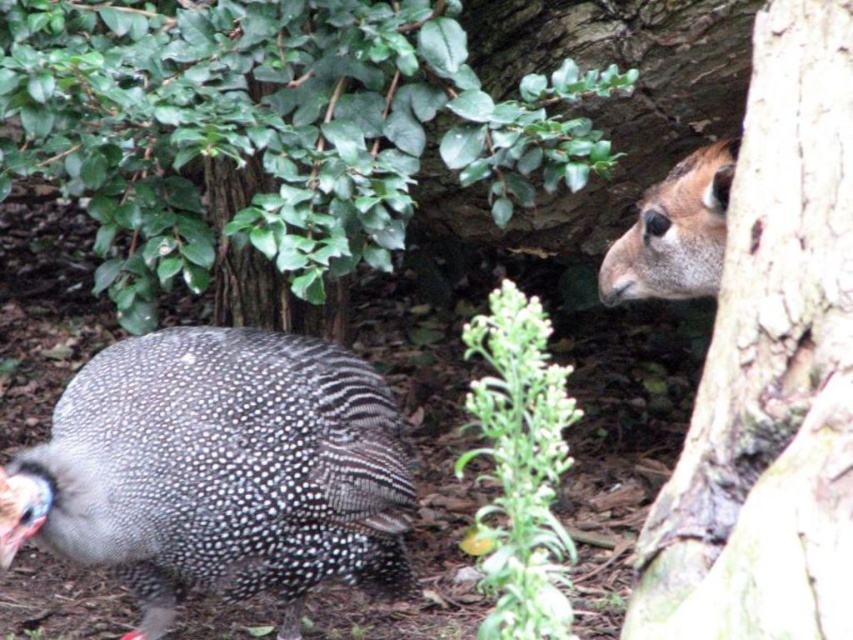
You are a photographer standing 1.5 meters away from the guinea fowl with a speckled plumage on the left. You want to take a photo of the guinea fowl and the gazelle head behind the brown rough tree trunk at right. Can you see the gazelle head through the tree trunk?

The brown rough tree trunk at right is 1.19 meters from viewer, which is closer than your distance to the guinea fowl. Since the tree trunk is between you and the gazelle head, it would block the view of the gazelle head.

You are taking a photo of two animals in a natural setting. You notice two points in the scene labeled as point 1 at coordinates (x=311, y=156) and point 2 at (x=109, y=538). Which point is closer to the camera?

Point 1 at coordinates (x=311, y=156) is closer to the camera than point 2 at (x=109, y=538).

You are an animal tracker trying to locate the gazelle in the image. The guinea fowl is on the left, and there is a point at coordinates (770, 371). Where should you look to find the gazelle?

The point at coordinates (770, 371) corresponds to the brown rough tree trunk at right, so the gazelle is partially hidden behind it. Look behind the brown rough tree trunk at right to find the gazelle.